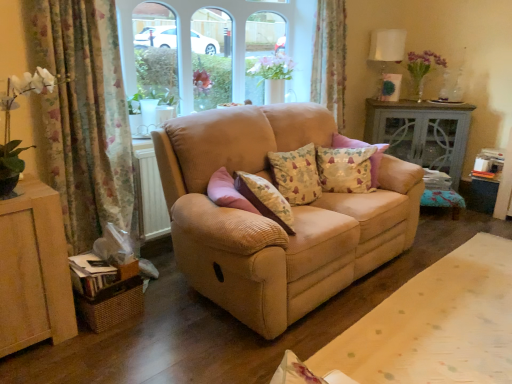
Question: Can you confirm if clear glass window at center is bigger than beige fabric sofa at center?

Choices:
 (A) no
 (B) yes

Answer: (B)

Question: Is clear glass window at center surrounding beige fabric sofa at center?

Choices:
 (A) yes
 (B) no

Answer: (B)

Question: Considering the relative sizes of clear glass window at center and beige fabric sofa at center in the image provided, is clear glass window at center shorter than beige fabric sofa at center?

Choices:
 (A) yes
 (B) no

Answer: (B)

Question: From a real-world perspective, is clear glass window at center beneath beige fabric sofa at center?

Choices:
 (A) no
 (B) yes

Answer: (A)

Question: Does clear glass window at center turn towards beige fabric sofa at center?

Choices:
 (A) no
 (B) yes

Answer: (B)

Question: Considering the positions of point (321, 375) and point (318, 167), is point (321, 375) closer or farther from the camera than point (318, 167)?

Choices:
 (A) closer
 (B) farther

Answer: (A)

Question: Considering the positions of beige fabric sofa at center and floral fabric pillow at center, which is counted as the second pillow, starting from the left, in the image, is beige fabric sofa at center bigger or smaller than floral fabric pillow at center, which is counted as the second pillow, starting from the left,?

Choices:
 (A) small
 (B) big

Answer: (B)

Question: From a real-world perspective, is beige fabric sofa at center above or below floral fabric pillow at center, the 1th pillow from the right?

Choices:
 (A) above
 (B) below

Answer: (A)

Question: Considering the positions of beige fabric sofa at center and floral fabric pillow at center, the 1th pillow from the right, in the image, is beige fabric sofa at center taller or shorter than floral fabric pillow at center, the 1th pillow from the right,?

Choices:
 (A) tall
 (B) short

Answer: (B)

Question: Is clear glass window at center bigger or smaller than floral fabric curtain at upper center, which appears as the 2th curtain when viewed from the left?

Choices:
 (A) big
 (B) small

Answer: (A)

Question: Visually, is clear glass window at center positioned to the left or to the right of floral fabric curtain at upper center, which appears as the 2th curtain when viewed from the left?

Choices:
 (A) right
 (B) left

Answer: (B)

Question: From the image's perspective, relative to floral fabric curtain at upper center, which appears as the 2th curtain when viewed from the left, is clear glass window at center above or below?

Choices:
 (A) above
 (B) below

Answer: (A)

Question: Is clear glass window at center situated inside floral fabric curtain at upper center, which is the 2th curtain in front-to-back order, or outside?

Choices:
 (A) outside
 (B) inside

Answer: (A)

Question: Based on their sizes in the image, would you say floral fabric curtain at upper center, placed as the first curtain when sorted from right to left, is bigger or smaller than beige corduroy couch at center?

Choices:
 (A) small
 (B) big

Answer: (A)

Question: Is point (338, 87) positioned closer to the camera than point (334, 281)?

Choices:
 (A) closer
 (B) farther

Answer: (B)